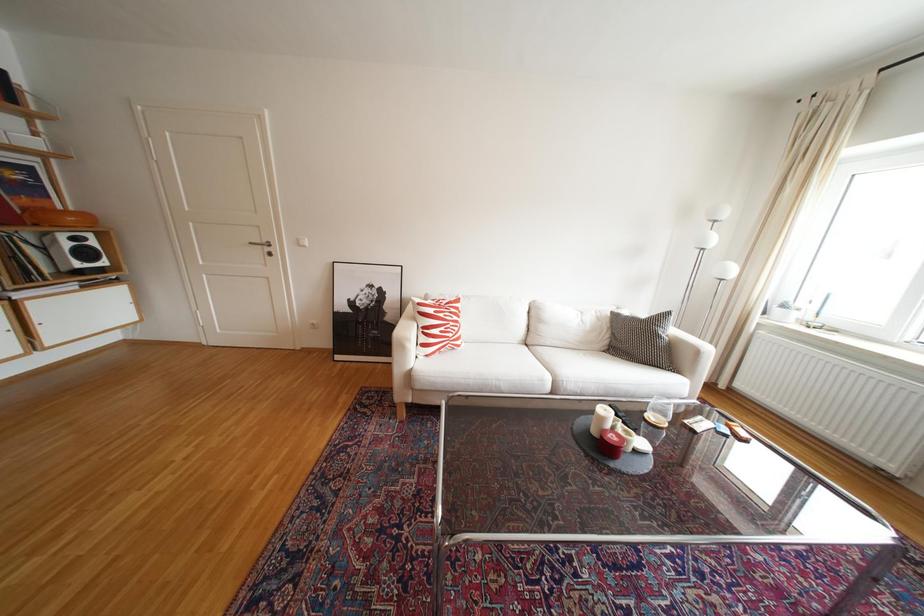
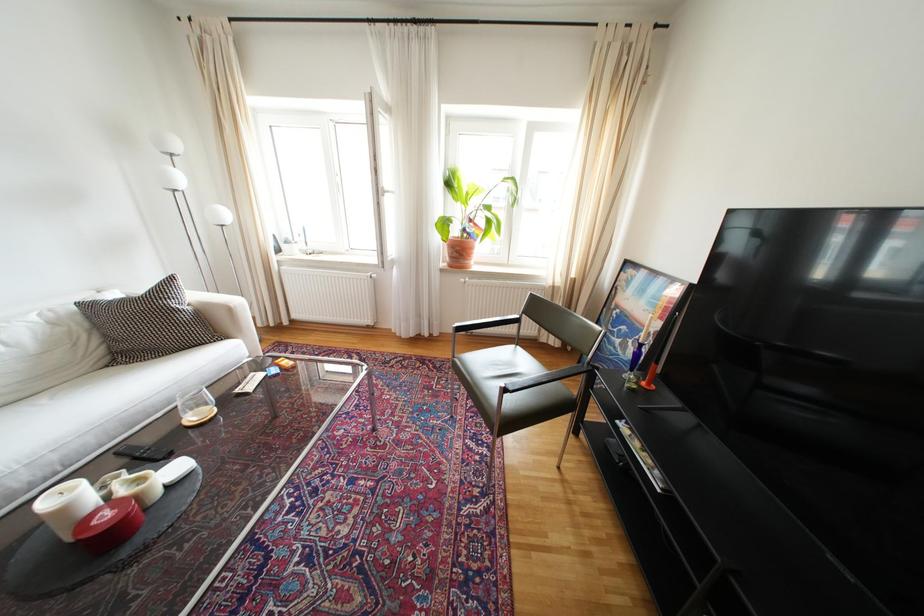
Looking at this image, first-person continuous shooting, in which direction is the camera rotating?

The camera rotated toward right-down.